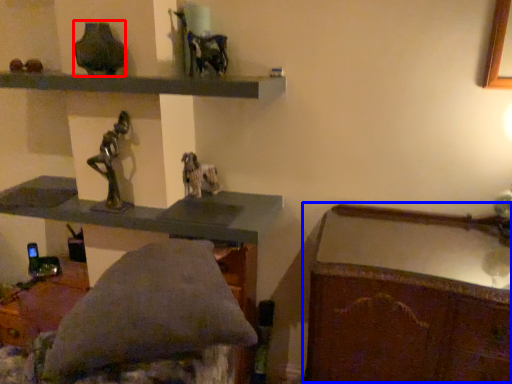
Question: Which of the following is the closest to the observer, vase (highlighted by a red box) or writing desk (highlighted by a blue box)?

Choices:
 (A) vase
 (B) writing desk

Answer: (B)